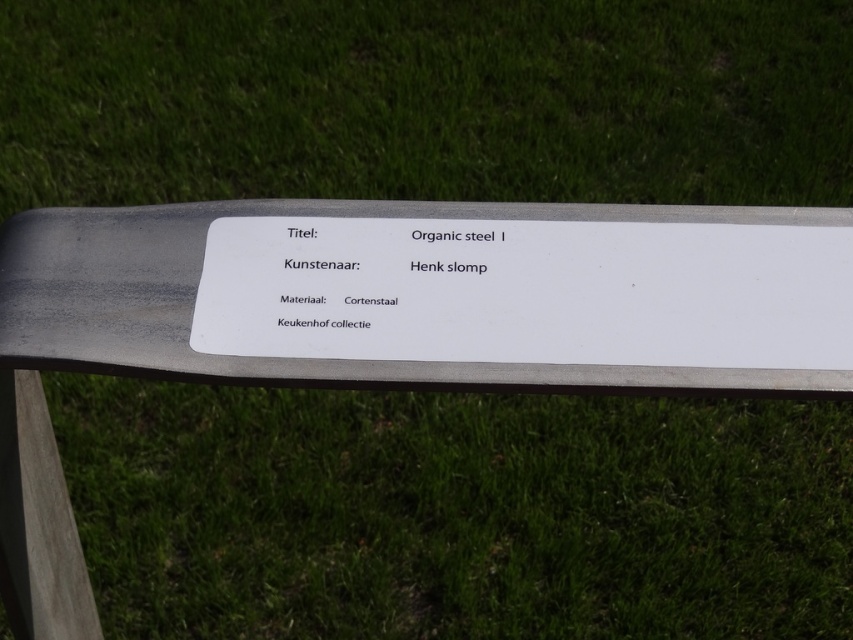
Question: Is cortensteel sign at center to the right of white organic steel i at center from the viewer's perspective?

Choices:
 (A) yes
 (B) no

Answer: (A)

Question: Which point is closer to the camera?

Choices:
 (A) cortensteel sign at center
 (B) white organic steel i at center

Answer: (A)

Question: Does cortensteel sign at center come behind white organic steel i at center?

Choices:
 (A) no
 (B) yes

Answer: (A)

Question: Which of the following is the closest to the observer?

Choices:
 (A) white organic steel i at center
 (B) cortensteel sign at center

Answer: (B)

Question: Where is cortensteel sign at center located in relation to white organic steel i at center in the image?

Choices:
 (A) above
 (B) below

Answer: (B)

Question: Which object is closer to the camera taking this photo?

Choices:
 (A) cortensteel sign at center
 (B) white organic steel i at center

Answer: (A)